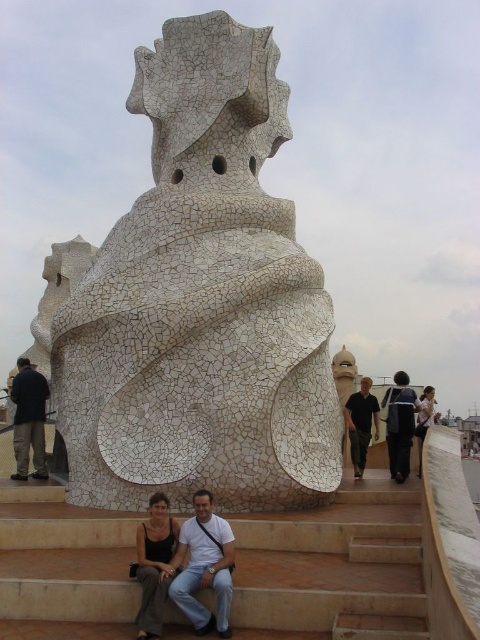
You are a photographer trying to capture both the white cracked stone sculpture at center and the matte white statue at center in a single frame. Which object should you focus on first to ensure both are in the frame?

You should focus on the white cracked stone sculpture at center first because it is taller than the matte white statue at center, so adjusting the camera angle to include its height will naturally include the shorter statue as well.

You are a photographer trying to capture both the matte black tank top at lower center and the dark gray fabric jacket at right in the same frame. Based on their positions, which one should you adjust your camera angle to focus on first to ensure both are in the shot?

The matte black tank top at lower center is to the left of the dark gray fabric jacket at right. To capture both in the same frame, focus on the matte black tank top at lower center first since it is positioned further left, allowing the camera angle to encompass the jacket on the right side.